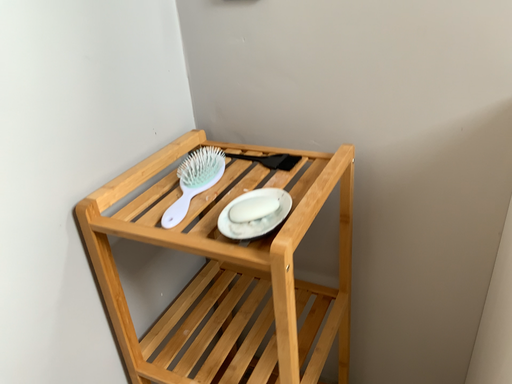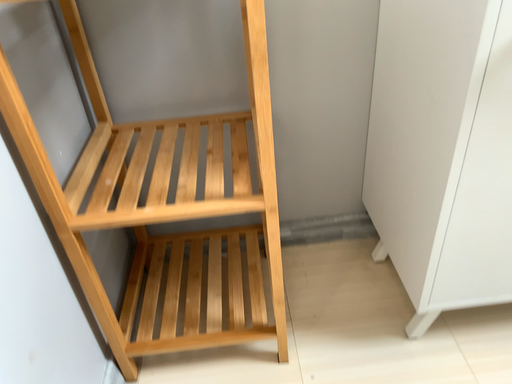
Question: How did the camera likely rotate when shooting the video?

Choices:
 (A) rotated right
 (B) rotated left

Answer: (A)